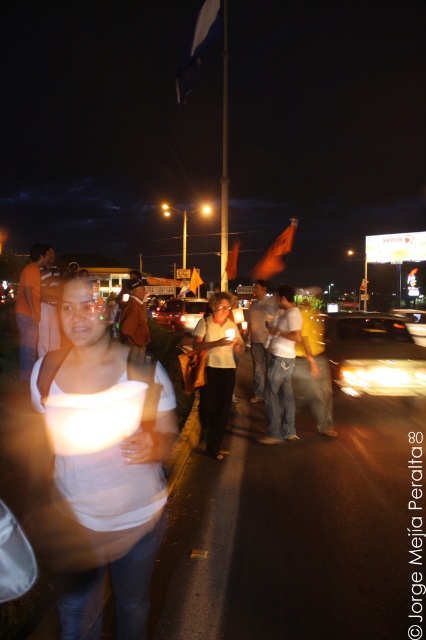
Question: Which point is farther to the camera?

Choices:
 (A) white cotton shirt at center
 (B) white matte lantern at center

Answer: (A)

Question: Does white cotton shirt at center appear on the left side of orange t-shirt at center?

Choices:
 (A) yes
 (B) no

Answer: (B)

Question: Which object is the farthest from the yellow fabric shirt at center?

Choices:
 (A) orange t-shirt at center
 (B) matte white shirt at center
 (C) light brown leather jacket at center
 (D) white cotton shirt at center

Answer: (B)

Question: Does orange t-shirt at center come behind brown leather jacket at center?

Choices:
 (A) yes
 (B) no

Answer: (B)

Question: Which object appears farthest from the camera in this image?

Choices:
 (A) white matte lantern at center
 (B) white matte shirt at center

Answer: (B)

Question: Where is white matte lantern at center located in relation to matte white shirt at center in the image?

Choices:
 (A) right
 (B) left

Answer: (A)